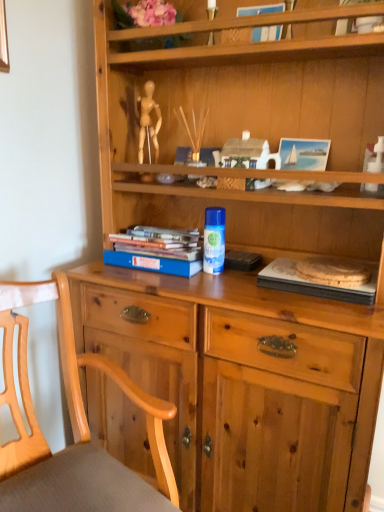
Where is `white plastic toy at upper right`? white plastic toy at upper right is located at coordinates (375, 157).

Measure the distance between point (x=370, y=169) and camera.

The depth of point (x=370, y=169) is 3.83 feet.

Measure the distance between hardcover books at left, which ranks as the 1th paperback book in left-to-right order, and camera.

hardcover books at left, which ranks as the 1th paperback book in left-to-right order, and camera are 1.24 meters apart from each other.

At what (x,y) coordinates should I click in order to perform the action: click on blue hardcover book at upper center. Please return your answer as a coordinate pair (x, y). Image resolution: width=384 pixels, height=512 pixels. Looking at the image, I should click on (267, 33).

Which object is further away from the camera taking this photo, wooden chair at lower left or white plastic toy at upper right?

Positioned behind is white plastic toy at upper right.

The image size is (384, 512). What are the coordinates of `toy on the right of wooden chair at lower left` in the screenshot? It's located at (375, 157).

From their relative heights in the image, would you say wooden chair at lower left is taller or shorter than white plastic toy at upper right?

Considering their sizes, wooden chair at lower left has more height than white plastic toy at upper right.

Is wooden chair at lower left facing away from white plastic toy at upper right?

No, wooden chair at lower left's orientation is not away from white plastic toy at upper right.

Between wooden textured book at lower right, the 1th paperback book when ordered from right to left, and hardcover books at left, acting as the 2th paperback book starting from the right, which one is positioned in front?

wooden textured book at lower right, the 1th paperback book when ordered from right to left, is in front.

Which is less distant, (x=326, y=295) or (x=119, y=265)?

Point (x=326, y=295).

From the image's perspective, between wooden textured book at lower right, arranged as the second paperback book when viewed from the left, and white plastic toy at upper right, who is located below?

wooden textured book at lower right, arranged as the second paperback book when viewed from the left.

Is wooden textured book at lower right, arranged as the second paperback book when viewed from the left, looking in the opposite direction of white plastic toy at upper right?

No, wooden textured book at lower right, arranged as the second paperback book when viewed from the left, is not facing the opposite direction of white plastic toy at upper right.

Which is more to the right, wooden textured book at lower right, arranged as the second paperback book when viewed from the left, or white plastic toy at upper right?

white plastic toy at upper right is more to the right.

Considering the relative sizes of wooden textured book at lower right, the 1th paperback book when ordered from right to left, and white plastic toy at upper right in the image provided, is wooden textured book at lower right, the 1th paperback book when ordered from right to left, bigger than white plastic toy at upper right?

Correct, wooden textured book at lower right, the 1th paperback book when ordered from right to left, is larger in size than white plastic toy at upper right.

In the scene shown: Is the position of white plastic toy at upper right more distant than that of wooden textured book at lower right, the 1th paperback book when ordered from right to left?

Yes, white plastic toy at upper right is behind wooden textured book at lower right, the 1th paperback book when ordered from right to left.

Between point (360, 189) and point (295, 276), which one is positioned in front?

The point (360, 189) is in front.

From a real-world perspective, does white plastic toy at upper right sit lower than wooden textured book at lower right, the 1th paperback book when ordered from right to left?

Actually, white plastic toy at upper right is physically above wooden textured book at lower right, the 1th paperback book when ordered from right to left, in the real world.

Is white plastic toy at upper right touching wooden textured book at lower right, arranged as the second paperback book when viewed from the left?

There is a gap between white plastic toy at upper right and wooden textured book at lower right, arranged as the second paperback book when viewed from the left.

Does point (269, 6) appear closer or farther from the camera than point (106, 256)?

Point (269, 6).

From a real-world perspective, is blue hardcover book at upper center positioned under hardcover books at left, acting as the 2th paperback book starting from the right, based on gravity?

Incorrect, from a real-world perspective, blue hardcover book at upper center is higher than hardcover books at left, acting as the 2th paperback book starting from the right.

Between blue hardcover book at upper center and hardcover books at left, which ranks as the 1th paperback book in left-to-right order, which one has more height?

blue hardcover book at upper center.

Which object is closer to the camera, blue hardcover book at upper center or hardcover books at left, acting as the 2th paperback book starting from the right?

blue hardcover book at upper center is in front.

Where is `toy that is above the hardcover books at left, which ranks as the 1th paperback book in left-to-right order (from the image's perspective)`? This screenshot has height=512, width=384. toy that is above the hardcover books at left, which ranks as the 1th paperback book in left-to-right order (from the image's perspective) is located at coordinates (375, 157).

Is white plastic toy at upper right in front of or behind hardcover books at left, which ranks as the 1th paperback book in left-to-right order, in the image?

white plastic toy at upper right is positioned closer to the viewer than hardcover books at left, which ranks as the 1th paperback book in left-to-right order.

Is white plastic toy at upper right turned away from hardcover books at left, which ranks as the 1th paperback book in left-to-right order?

No, white plastic toy at upper right's orientation is not away from hardcover books at left, which ranks as the 1th paperback book in left-to-right order.

Is white plastic toy at upper right at the left side of hardcover books at left, acting as the 2th paperback book starting from the right?

No, white plastic toy at upper right is not to the left of hardcover books at left, acting as the 2th paperback book starting from the right.

Is blue hardcover book at upper center positioned with its back to white plastic toy at upper right?

blue hardcover book at upper center does not have its back to white plastic toy at upper right.

Are blue hardcover book at upper center and white plastic toy at upper right making contact?

No, blue hardcover book at upper center is not beside white plastic toy at upper right.

You are a GUI agent. You are given a task and a screenshot of the screen. Output one action in this format:
    pyautogui.click(x=<x>, y=<y>)
    Task: Click on the toy lying below the blue hardcover book at upper center (from the image's perspective)
    This screenshot has width=384, height=512.
    Given the screenshot: What is the action you would take?
    pyautogui.click(x=375, y=157)

The width and height of the screenshot is (384, 512). I want to click on chair in front of the white plastic toy at upper right, so click(x=72, y=426).

Identify the location of paperback book on the left of wooden textured book at lower right, arranged as the second paperback book when viewed from the left. This screenshot has width=384, height=512. (157, 250).

Which object lies further to the anchor point white plastic toy at upper right, wooden textured book at lower right, the 1th paperback book when ordered from right to left, or hardcover books at left, acting as the 2th paperback book starting from the right?

hardcover books at left, acting as the 2th paperback book starting from the right.

Estimate the real-world distances between objects in this image. Which object is further from wooden chair at lower left, hardcover books at left, which ranks as the 1th paperback book in left-to-right order, or white plastic toy at upper right?

Based on the image, white plastic toy at upper right appears to be further to wooden chair at lower left.

Which object lies further to the anchor point wooden chair at lower left, white plastic toy at upper right or hardcover books at left, acting as the 2th paperback book starting from the right?

Based on the image, white plastic toy at upper right appears to be further to wooden chair at lower left.

Consider the image. Looking at the image, which one is located further to white plastic toy at upper right, hardcover books at left, acting as the 2th paperback book starting from the right, or wooden chair at lower left?

wooden chair at lower left lies further to white plastic toy at upper right than the other object.

Estimate the real-world distances between objects in this image. Which object is closer to wooden textured book at lower right, arranged as the second paperback book when viewed from the left, wooden chair at lower left or white plastic toy at upper right?

Based on the image, white plastic toy at upper right appears to be nearer to wooden textured book at lower right, arranged as the second paperback book when viewed from the left.

Looking at the image, which one is located further to blue hardcover book at upper center, wooden textured book at lower right, the 1th paperback book when ordered from right to left, or hardcover books at left, acting as the 2th paperback book starting from the right?

The object further to blue hardcover book at upper center is hardcover books at left, acting as the 2th paperback book starting from the right.

Looking at this image, which object lies nearer to the anchor point wooden chair at lower left, wooden textured book at lower right, arranged as the second paperback book when viewed from the left, or hardcover books at left, which ranks as the 1th paperback book in left-to-right order?

Based on the image, hardcover books at left, which ranks as the 1th paperback book in left-to-right order, appears to be nearer to wooden chair at lower left.

Based on their spatial positions, is white plastic toy at upper right or hardcover books at left, acting as the 2th paperback book starting from the right, further from blue hardcover book at upper center?

hardcover books at left, acting as the 2th paperback book starting from the right, is further to blue hardcover book at upper center.

Locate an element on the screen. paperback book situated between hardcover books at left, which ranks as the 1th paperback book in left-to-right order, and white plastic toy at upper right from left to right is located at coordinates (312, 284).

What are the coordinates of `toy between blue hardcover book at upper center and wooden textured book at lower right, the 1th paperback book when ordered from right to left, vertically` in the screenshot? It's located at (375, 157).

Find the location of a particular element. paperback book located between wooden chair at lower left and hardcover books at left, which ranks as the 1th paperback book in left-to-right order, in the depth direction is located at coordinates (312, 284).

Identify the location of toy between wooden chair at lower left and hardcover books at left, acting as the 2th paperback book starting from the right, from front to back. The width and height of the screenshot is (384, 512). (375, 157).